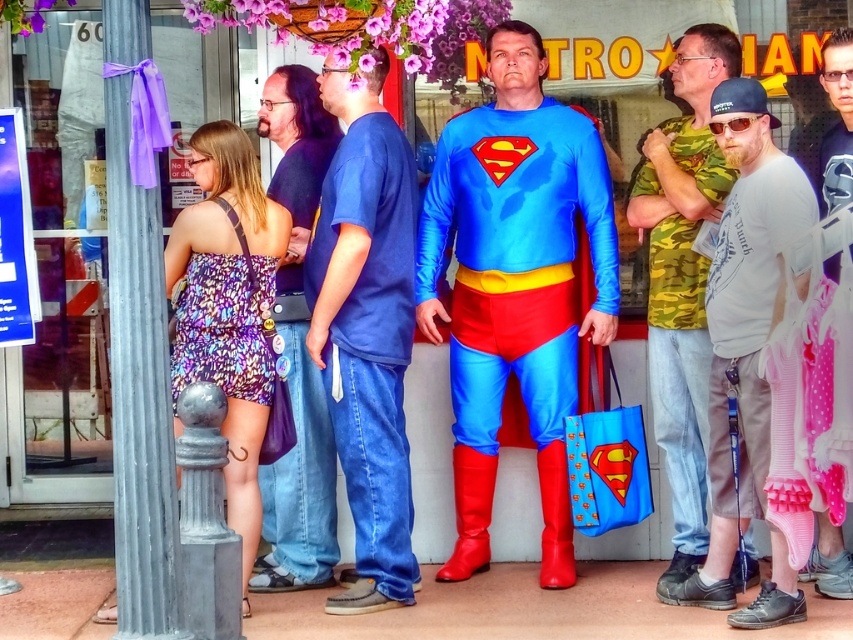
Question: Where is gray cotton t-shirt at center-right located in relation to dark blue t-shirt at center in the image?

Choices:
 (A) below
 (B) above

Answer: (A)

Question: Can you confirm if gray cotton t-shirt at center-right is positioned to the left of printed fabric dress at center?

Choices:
 (A) no
 (B) yes

Answer: (A)

Question: Which object appears closest to the camera in this image?

Choices:
 (A) shiny spandex suit at center
 (B) printed fabric dress at center

Answer: (B)

Question: Does blue cotton t-shirt at center appear under blue denim jeans at center?

Choices:
 (A) no
 (B) yes

Answer: (B)

Question: Estimate the real-world distances between objects in this image. Which object is closer to the dark blue t-shirt at center?

Choices:
 (A) blue denim jeans at center
 (B) camouflage-patterned shirt at center-right
 (C) gray cotton t-shirt at center-right
 (D) blue cotton t-shirt at center

Answer: (B)

Question: Which object appears closest to the camera in this image?

Choices:
 (A) gray cotton t-shirt at center-right
 (B) camouflage-patterned shirt at center-right
 (C) blue denim jeans at center
 (D) printed fabric dress at center

Answer: (A)